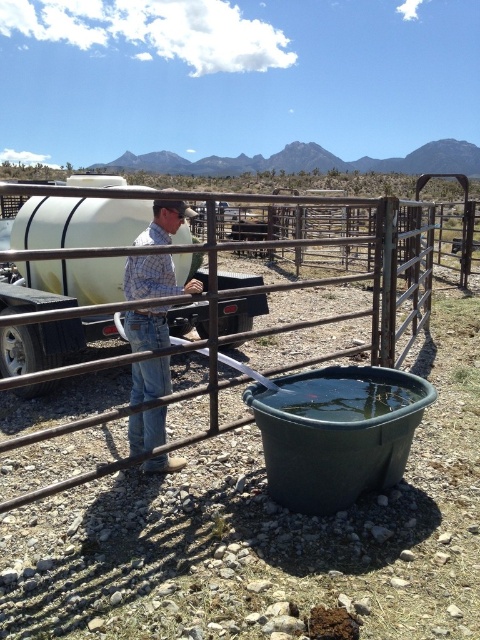
Question: Does rustic metal fence at center appear on the left side of plaid shirt at center?

Choices:
 (A) yes
 (B) no

Answer: (B)

Question: Is white matte trailer truck at center bigger than plaid shirt at center?

Choices:
 (A) no
 (B) yes

Answer: (B)

Question: Which object is the farthest from the white matte trailer truck at center?

Choices:
 (A) plaid shirt at center
 (B) rustic metal fence at center

Answer: (B)

Question: Which point is closer to the camera taking this photo?

Choices:
 (A) (84, 333)
 (B) (208, 243)
 (C) (152, 426)

Answer: (B)

Question: Which of these objects is positioned farthest from the white matte trailer truck at center?

Choices:
 (A) plaid shirt at center
 (B) rustic metal fence at center

Answer: (B)

Question: Is rustic metal fence at center positioned at the back of plaid shirt at center?

Choices:
 (A) yes
 (B) no

Answer: (B)